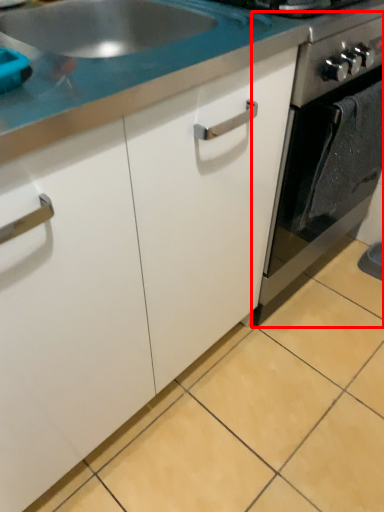
Question: From the image's perspective, considering the relative positions of oven (annotated by the red box) and countertop in the image provided, where is oven (annotated by the red box) located with respect to the staircase?

Choices:
 (A) above
 (B) below

Answer: (B)